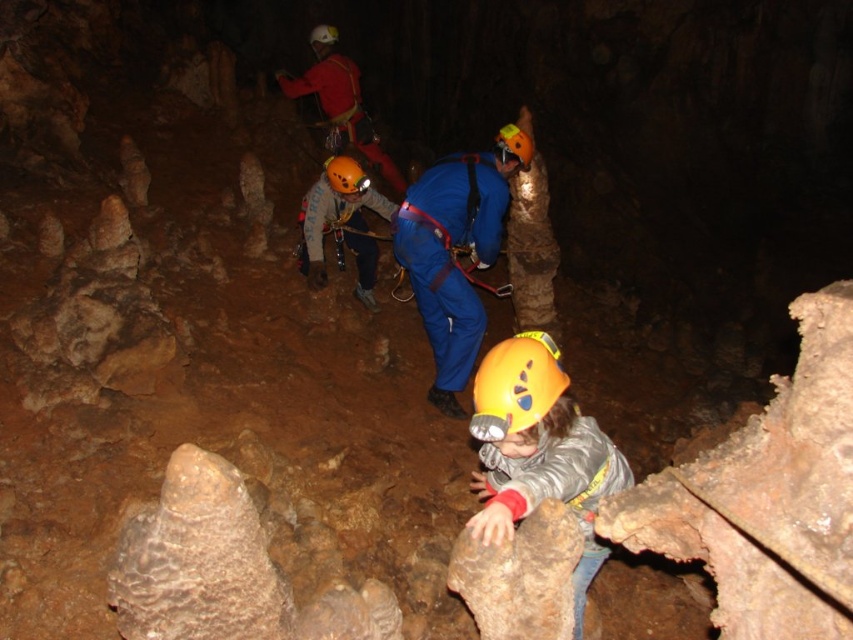
Does point (604, 481) lie in front of point (352, 163)?

That is True.

Does yellow matte helmet at center have a greater width compared to matte orange helmet at center?

Correct, the width of yellow matte helmet at center exceeds that of matte orange helmet at center.

Who is more forward, (495,492) or (355,164)?

Point (495,492) is in front.

This screenshot has height=640, width=853. In order to click on yellow matte helmet at center in this screenshot , I will do `click(538, 451)`.

Who is more forward, (476,419) or (323,36)?

Point (476,419) is in front.

Is yellow matte helmet at lower center shorter than white matte helmet at upper center?

Indeed, yellow matte helmet at lower center has a lesser height compared to white matte helmet at upper center.

Is point (549, 353) positioned after point (314, 52)?

That is False.

You are a GUI agent. You are given a task and a screenshot of the screen. Output one action in this format:
    pyautogui.click(x=<x>, y=<y>)
    Task: Click on the yellow matte helmet at lower center
    
    Given the screenshot: What is the action you would take?
    pyautogui.click(x=515, y=385)

Based on the photo, which is more to the right, blue fabric helmet at center or matte blue jumpsuit at center?

blue fabric helmet at center

Is blue fabric helmet at center closer to the viewer compared to matte blue jumpsuit at center?

Yes, it is.

Is point (430, 323) positioned behind point (331, 205)?

No.

Locate an element on the screen. The image size is (853, 640). blue fabric helmet at center is located at coordinates (451, 259).